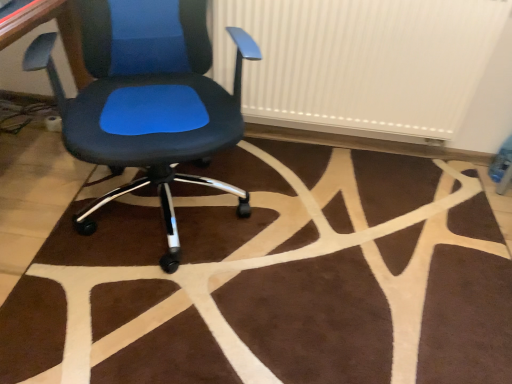
You are a GUI agent. You are given a task and a screenshot of the screen. Output one action in this format:
    pyautogui.click(x=<x>, y=<y>)
    Task: Click on the matte black office chair at center
    
    Given the screenshot: What is the action you would take?
    pyautogui.click(x=153, y=101)

Measure the distance between brown plush rug at center and camera.

brown plush rug at center and camera are 1.07 meters apart from each other.

Find the location of a particular element. The height and width of the screenshot is (384, 512). matte black office chair at center is located at coordinates (153, 101).

Which of these two, white ribbed radiator at upper center or matte black office chair at center, stands taller?

With more height is matte black office chair at center.

At what (x,y) coordinates should I click in order to perform the action: click on chair in front of the white ribbed radiator at upper center. Please return your answer as a coordinate pair (x, y). The height and width of the screenshot is (384, 512). Looking at the image, I should click on (153, 101).

From the picture: Is matte black office chair at center at the back of white ribbed radiator at upper center?

white ribbed radiator at upper center is not turned away from matte black office chair at center.

From a real-world perspective, who is located higher, white ribbed radiator at upper center or matte black office chair at center?

white ribbed radiator at upper center.

From the image's perspective, is brown plush rug at center positioned above or below white ribbed radiator at upper center?

From the image's perspective, brown plush rug at center appears below white ribbed radiator at upper center.

Between brown plush rug at center and white ribbed radiator at upper center, which one has smaller size?

brown plush rug at center.

Based on the photo, from a real-world perspective, does brown plush rug at center sit lower than white ribbed radiator at upper center?

Yes, from a real-world perspective, brown plush rug at center is under white ribbed radiator at upper center.

Is brown plush rug at center not within white ribbed radiator at upper center?

A: Yes, brown plush rug at center is not within white ribbed radiator at upper center.

From the image's perspective, is brown plush rug at center above matte black office chair at center?

Incorrect, from the image's perspective, brown plush rug at center is lower than matte black office chair at center.

Is brown plush rug at center behind matte black office chair at center?

Yes, it is behind matte black office chair at center.

Considering the sizes of objects brown plush rug at center and matte black office chair at center in the image provided, who is shorter, brown plush rug at center or matte black office chair at center?

brown plush rug at center.

Consider the image. Is brown plush rug at center directly adjacent to matte black office chair at center?

No, brown plush rug at center is not with matte black office chair at center.

From the image's perspective, is white ribbed radiator at upper center located above or below brown plush rug at center?

white ribbed radiator at upper center is situated higher than brown plush rug at center in the image.

Would you say white ribbed radiator at upper center is outside brown plush rug at center?

white ribbed radiator at upper center is positioned outside brown plush rug at center.

Where is `mat below the white ribbed radiator at upper center (from the image's perspective)`? mat below the white ribbed radiator at upper center (from the image's perspective) is located at coordinates (274, 279).

Do you think matte black office chair at center is within white ribbed radiator at upper center, or outside of it?

matte black office chair at center is not inside white ribbed radiator at upper center, it's outside.

Is matte black office chair at center not close to white ribbed radiator at upper center?

No.

Which of these two, matte black office chair at center or white ribbed radiator at upper center, is smaller?

white ribbed radiator at upper center is smaller.

Which of these two, matte black office chair at center or brown plush rug at center, stands shorter?

Standing shorter between the two is brown plush rug at center.

Is matte black office chair at center in front of or behind brown plush rug at center in the image?

In the image, matte black office chair at center appears in front of brown plush rug at center.

Locate an element on the screen. Image resolution: width=512 pixels, height=384 pixels. chair above the brown plush rug at center (from the image's perspective) is located at coordinates (153, 101).

Locate an element on the screen. This screenshot has height=384, width=512. radiator behind the matte black office chair at center is located at coordinates coord(374,67).

Find the location of `mat on the left of white ribbed radiator at upper center`. mat on the left of white ribbed radiator at upper center is located at coordinates (274, 279).

When comparing their distances from white ribbed radiator at upper center, does matte black office chair at center or brown plush rug at center seem closer?

The object closer to white ribbed radiator at upper center is matte black office chair at center.

From the image, which object appears to be farther from white ribbed radiator at upper center, brown plush rug at center or matte black office chair at center?

Based on the image, brown plush rug at center appears to be further to white ribbed radiator at upper center.

Which object lies nearer to the anchor point matte black office chair at center, brown plush rug at center or white ribbed radiator at upper center?

white ribbed radiator at upper center lies closer to matte black office chair at center than the other object.

Considering their positions, is white ribbed radiator at upper center positioned further to brown plush rug at center than matte black office chair at center?

white ribbed radiator at upper center lies further to brown plush rug at center than the other object.

Consider the image. Estimate the real-world distances between objects in this image. Which object is further from matte black office chair at center, white ribbed radiator at upper center or brown plush rug at center?

The object further to matte black office chair at center is brown plush rug at center.

When comparing their distances from brown plush rug at center, does matte black office chair at center or white ribbed radiator at upper center seem closer?

matte black office chair at center is positioned closer to the anchor brown plush rug at center.

Locate an element on the screen. mat situated between matte black office chair at center and white ribbed radiator at upper center from left to right is located at coordinates (274, 279).